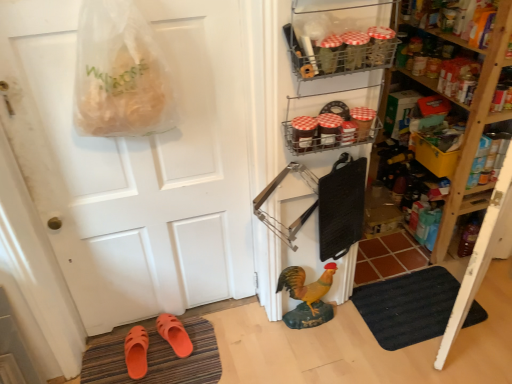
The width and height of the screenshot is (512, 384). In order to click on vacant region to the left of black rubber doormat at lower right, placed as the 2th doormat when sorted from left to right in this screenshot , I will do `click(338, 344)`.